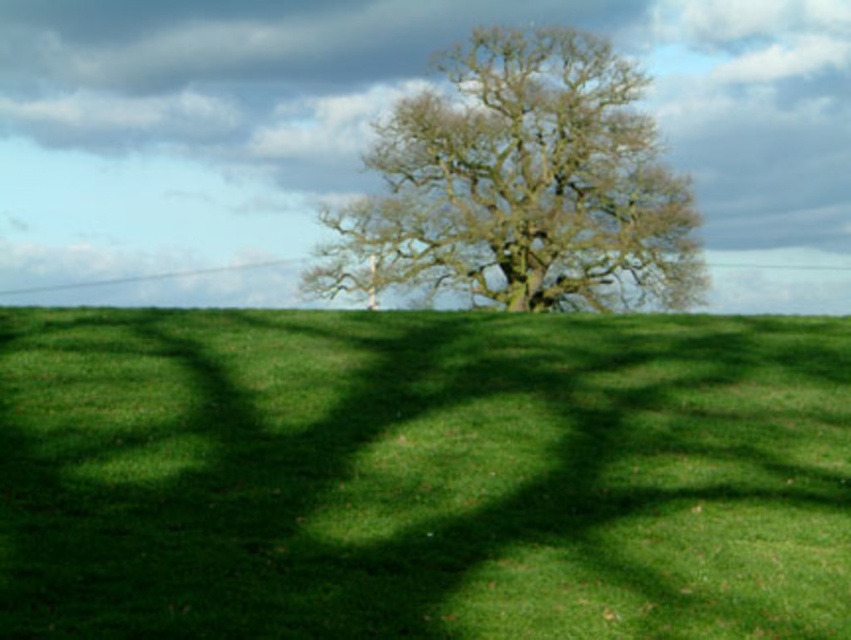
You are a landscape architect designing a walking path that must be at least 20 meters wide between the green grass at center and the green leafy tree at center. Can the path be placed between them without violating the width requirement?

The distance between the green grass at center and the green leafy tree at center is 25.84 meters, which is wider than the required 20 meters. Therefore, the path can be placed between them without violating the width requirement.

You are standing at the point labeled as point (842, 637) in the image. A friend is standing 10 meters away from you in the same direction. Can your friend see the large leafless tree in the center?

The distance between you and the viewer is 8.23 meters. Since your friend is 10 meters away from you in the same direction, they are 18.23 meters away from the tree. However, the tree is large and centrally located, so your friend can still see it unless there are obstructions not mentioned in the scene description.

You are standing at the origin point of the coordinate system in the image. You want to walk to the green grass at center. Which direction should you move in terms of x and y coordinates?

The green grass at center is located at coordinate point 0.744 in the x direction and 0.497 in the y direction. Since you are at the origin, you should move in the positive x and positive y directions to reach it.